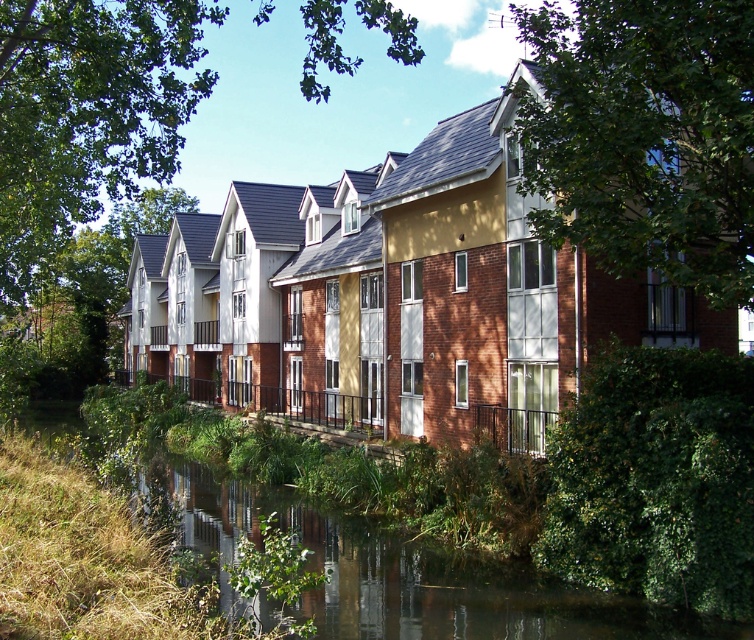
Question: Among these points, which one is nearest to the camera?

Choices:
 (A) (397, 620)
 (B) (173, 4)
 (C) (725, 77)

Answer: (C)

Question: Is green leafy tree at upper center below green leafy tree at upper left?

Choices:
 (A) yes
 (B) no

Answer: (A)

Question: Can you confirm if green leafy tree at upper center is positioned below green grassy bank at lower left?

Choices:
 (A) no
 (B) yes

Answer: (A)

Question: Which point is farther from the camera taking this photo?

Choices:
 (A) pyautogui.click(x=11, y=221)
 (B) pyautogui.click(x=642, y=52)

Answer: (A)

Question: Does green leafy tree at upper left appear on the right side of green grassy bank at lower left?

Choices:
 (A) yes
 (B) no

Answer: (B)

Question: Which object is the closest to the green leafy tree at upper center?

Choices:
 (A) green grassy bank at lower left
 (B) green leafy tree at upper left

Answer: (A)